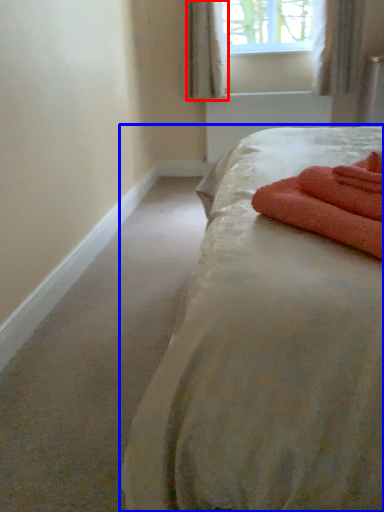
Question: Which of the following is the closest to the observer, curtain (highlighted by a red box) or bed (highlighted by a blue box)?

Choices:
 (A) curtain
 (B) bed

Answer: (B)